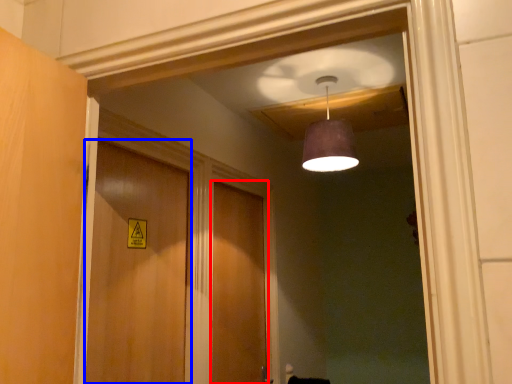
Question: Among these objects, which one is farthest to the camera, door (highlighted by a red box) or door (highlighted by a blue box)?

Choices:
 (A) door
 (B) door

Answer: (A)